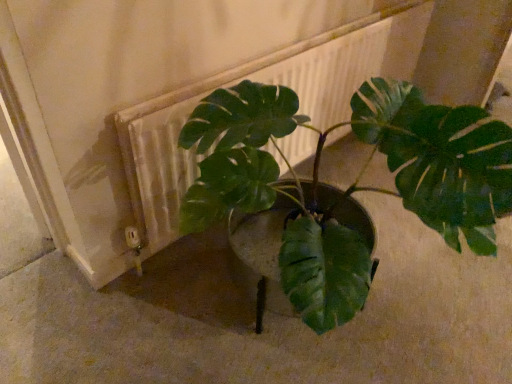
Question: From a real-world perspective, relative to green matte plant at center, is white textured radiator at center vertically above or below?

Choices:
 (A) below
 (B) above

Answer: (A)

Question: Considering their positions, is white textured radiator at center located in front of or behind green matte plant at center?

Choices:
 (A) front
 (B) behind

Answer: (B)

Question: Considering the positions of white textured radiator at center and green matte plant at center in the image, is white textured radiator at center wider or thinner than green matte plant at center?

Choices:
 (A) wide
 (B) thin

Answer: (B)

Question: From their relative heights in the image, would you say green matte plant at center is taller or shorter than white textured radiator at center?

Choices:
 (A) short
 (B) tall

Answer: (B)

Question: In terms of width, does green matte plant at center look wider or thinner when compared to white textured radiator at center?

Choices:
 (A) wide
 (B) thin

Answer: (A)

Question: In the image, is green matte plant at center positioned in front of or behind white textured radiator at center?

Choices:
 (A) front
 (B) behind

Answer: (A)

Question: Based on their positions, is green matte plant at center located to the left or right of white textured radiator at center?

Choices:
 (A) right
 (B) left

Answer: (B)